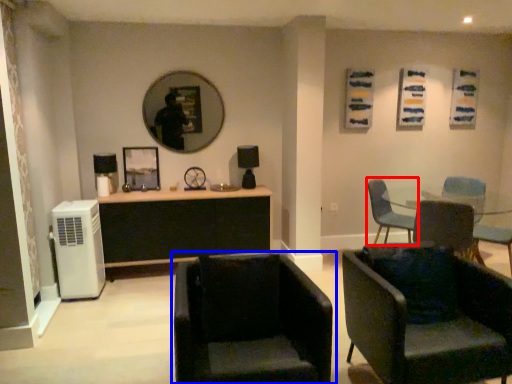
Question: Which object is closer to the camera taking this photo, chair (highlighted by a red box) or chair (highlighted by a blue box)?

Choices:
 (A) chair
 (B) chair

Answer: (B)